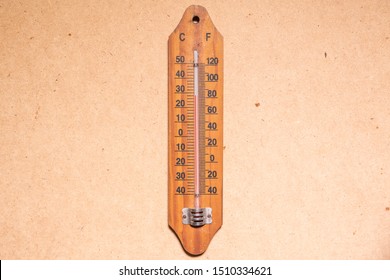
Find the location of a particular element. thermometer is located at coordinates (206, 21).